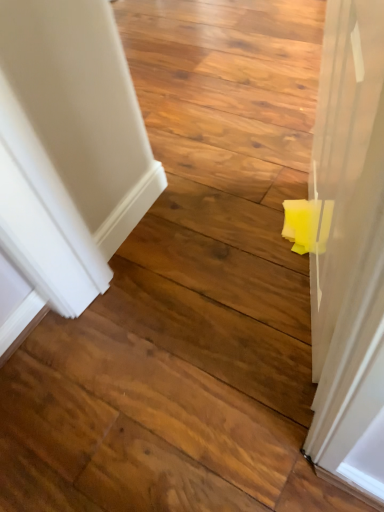
Find the location of `vacant location behind yellow sponge at right`. vacant location behind yellow sponge at right is located at coordinates (241, 186).